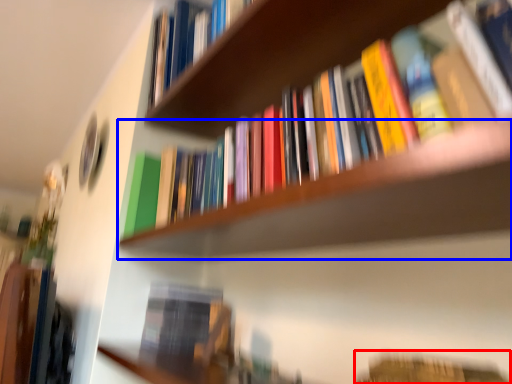
Question: Which point is further to the camera, book (highlighted by a red box) or shelf (highlighted by a blue box)?

Choices:
 (A) book
 (B) shelf

Answer: (A)